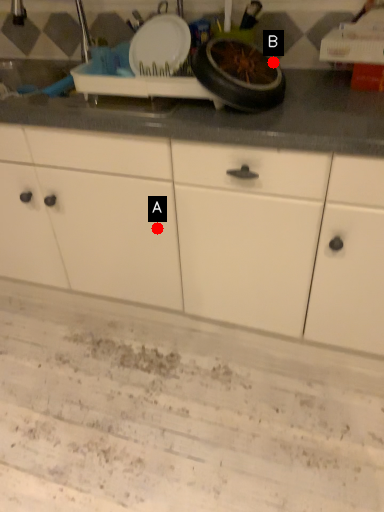
Question: Two points are circled on the image, labeled by A and B beside each circle. Which point is closer to the camera?

Choices:
 (A) A is closer
 (B) B is closer

Answer: (B)